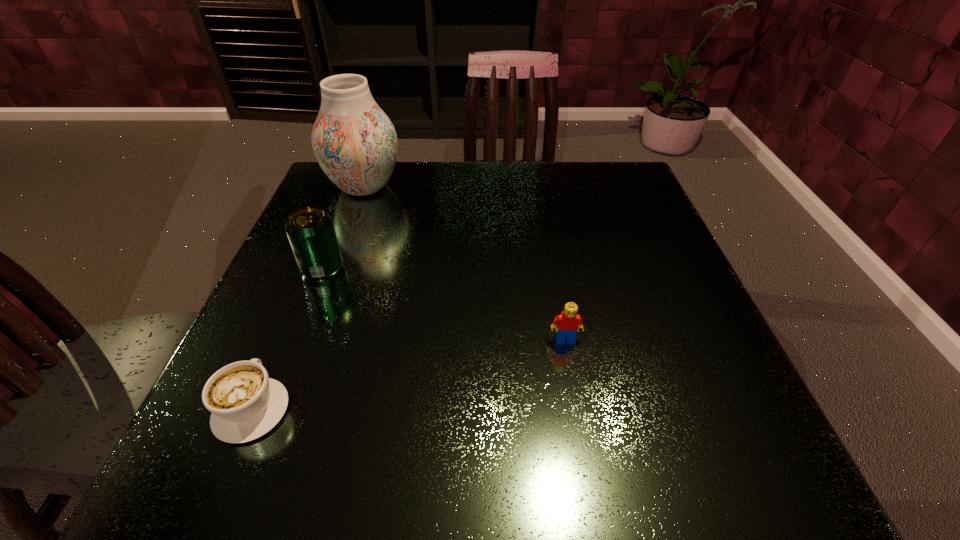
The height and width of the screenshot is (540, 960). I want to click on vacant space located on the face of the Lego, so click(589, 473).

Locate an element on the screen. The height and width of the screenshot is (540, 960). free space located 0.280m to the right of the cappuccino's handle is located at coordinates pyautogui.click(x=315, y=258).

Where is `free space located 0.360m to the right of the cappuccino's handle`? free space located 0.360m to the right of the cappuccino's handle is located at coordinates (325, 234).

I want to click on vacant space located 0.070m to the right of the cappuccino's handle, so click(x=280, y=341).

Identify the location of object located at the far edge. This screenshot has height=540, width=960. (355, 143).

Image resolution: width=960 pixels, height=540 pixels. I want to click on object that is at the near edge, so click(245, 403).

At what (x,y) coordinates should I click in order to perform the action: click on vase positioned at the left edge. Please return your answer as a coordinate pair (x, y). Looking at the image, I should click on (355, 143).

At what (x,y) coordinates should I click in order to perform the action: click on beer can that is at the left edge. Please return your answer as a coordinate pair (x, y). Looking at the image, I should click on (310, 230).

Where is `cappuccino at the left edge`? cappuccino at the left edge is located at coordinates (245, 403).

Find the location of `object that is at the far left corner`. object that is at the far left corner is located at coordinates [x=355, y=143].